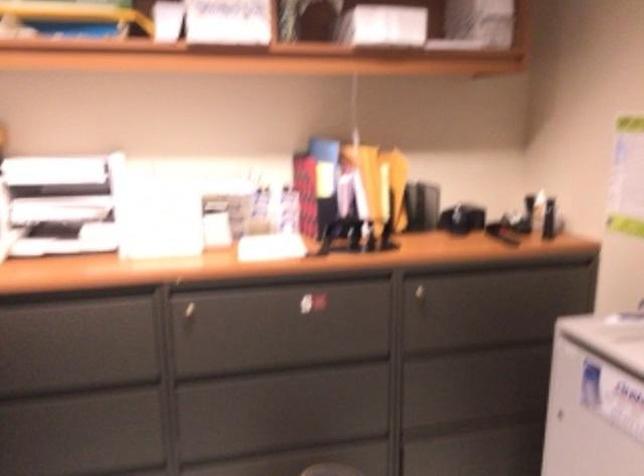
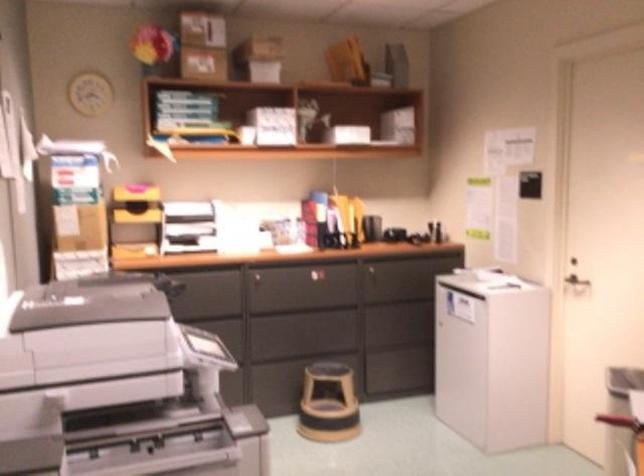
In the second image, find the point that corresponds to (288,296) in the first image.

(306, 272)